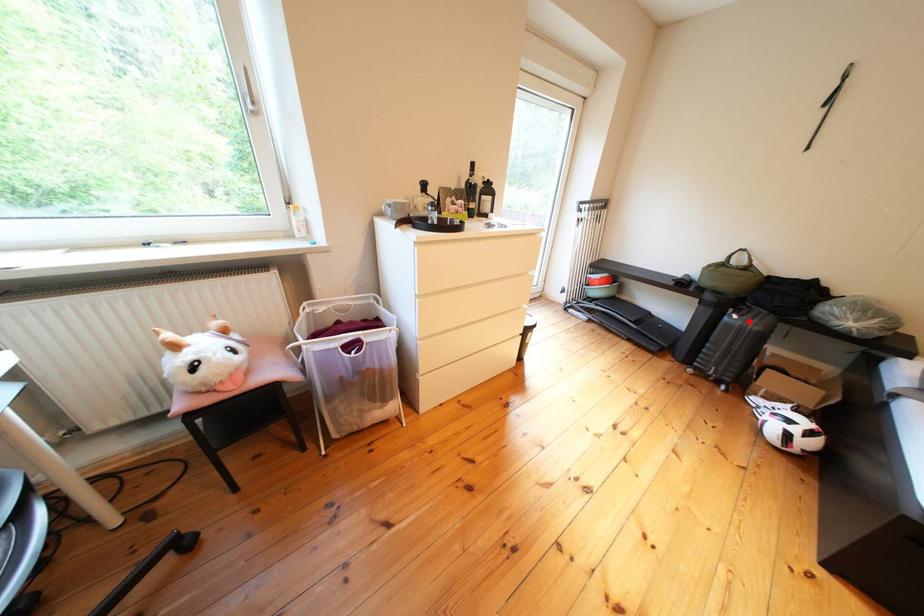
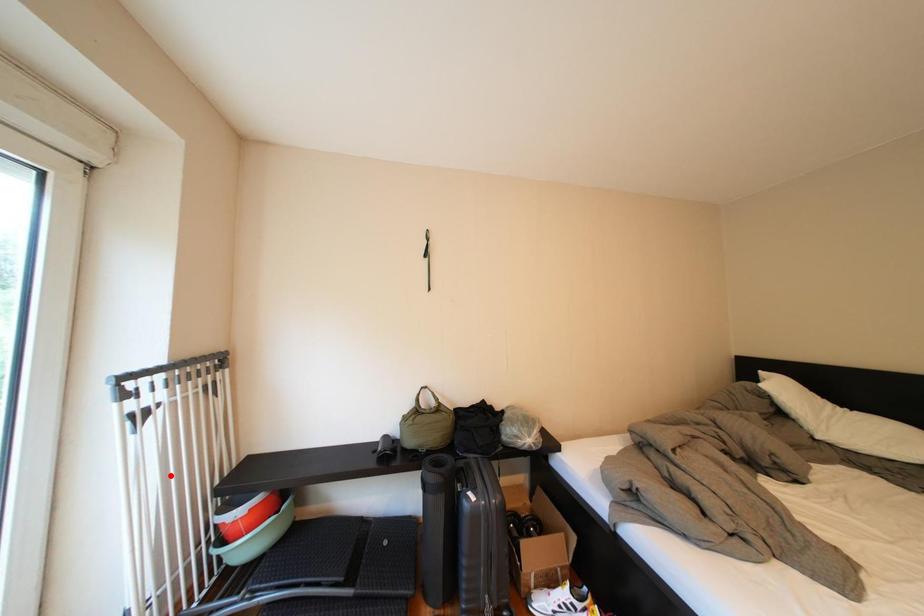
I am providing you with two images of the same scene from different viewpoints. A red point is marked on the first image and another point is marked on the second image. Are the points marked in image1 and image2 representing the same 3D position?

No